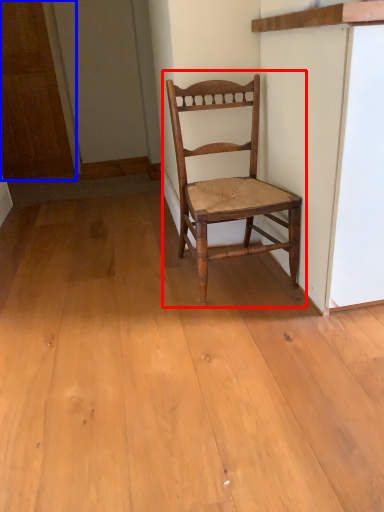
Question: Among these objects, which one is nearest to the camera, chair (highlighted by a red box) or door (highlighted by a blue box)?

Choices:
 (A) chair
 (B) door

Answer: (A)